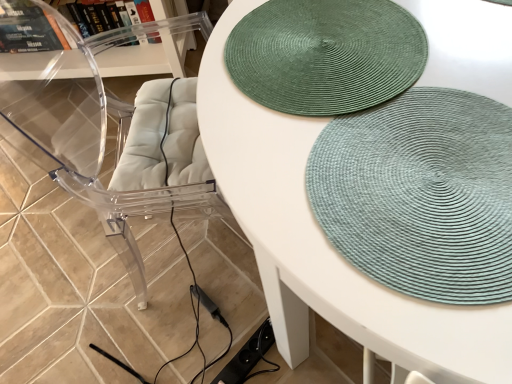
Question: Is transparent acrylic swivel chair at left taller or shorter than transparent plastic shelf at upper left?

Choices:
 (A) tall
 (B) short

Answer: (A)

Question: Would you say transparent acrylic swivel chair at left is inside or outside transparent plastic shelf at upper left?

Choices:
 (A) outside
 (B) inside

Answer: (A)

Question: Which of these objects is positioned farthest from the transparent plastic shelf at upper left?

Choices:
 (A) transparent acrylic swivel chair at left
 (B) green woven placemat at upper center
 (C) green woven mat at upper center, which is the first mat from top to bottom
 (D) green woven mat at upper right, marked as the second mat in a top-to-bottom arrangement

Answer: (D)

Question: Which object is positioned farthest from the green woven mat at upper center, which is the first mat from top to bottom?

Choices:
 (A) green woven placemat at upper center
 (B) transparent acrylic swivel chair at left
 (C) transparent plastic shelf at upper left
 (D) green woven mat at upper right, the first mat in the bottom-to-top sequence

Answer: (C)